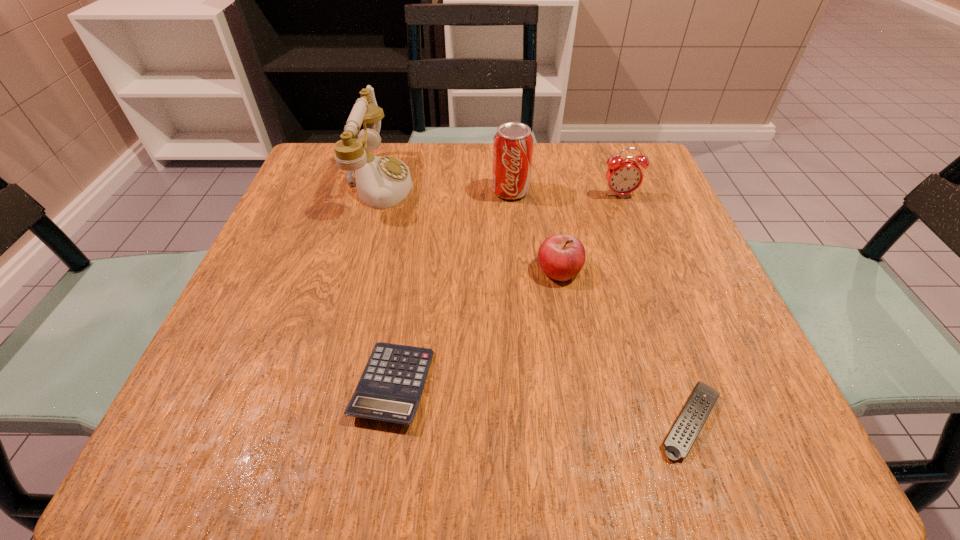
This screenshot has height=540, width=960. Identify the location of vacant space that's between the apple and the telephone. (469, 226).

Identify the location of unoccupied area between the tallest object and the remote control. The height and width of the screenshot is (540, 960). (535, 302).

Locate which object is the closest to the calculator. Please provide its 2D coordinates. Your answer should be formatted as a tuple, i.e. [(x, y)], where the tuple contains the x and y coordinates of a point satisfying the conditions above.

[(561, 257)]

Locate which object ranks in proximity to the alarm clock. Please provide its 2D coordinates. Your answer should be formatted as a tuple, i.e. [(x, y)], where the tuple contains the x and y coordinates of a point satisfying the conditions above.

[(513, 143)]

Find the location of a particular element. This screenshot has height=540, width=960. free region that satisfies the following two spatial constraints: 1. on the back side of the second tallest object; 2. on the dial of the tallest object is located at coordinates (510, 183).

Find the location of a particular element. The height and width of the screenshot is (540, 960). vacant area in the image that satisfies the following two spatial constraints: 1. on the dial of the tallest object; 2. on the left side of the remote control is located at coordinates (313, 421).

Image resolution: width=960 pixels, height=540 pixels. Find the location of `vacant space that satisfies the following two spatial constraints: 1. on the dial of the telephone; 2. on the right side of the shortest object`. vacant space that satisfies the following two spatial constraints: 1. on the dial of the telephone; 2. on the right side of the shortest object is located at coordinates (313, 421).

At what (x,y) coordinates should I click in order to perform the action: click on vacant space that satisfies the following two spatial constraints: 1. on the back side of the soda can; 2. on the dial of the telephone. Please return your answer as a coordinate pair (x, y). Looking at the image, I should click on (510, 183).

The height and width of the screenshot is (540, 960). I want to click on free space that satisfies the following two spatial constraints: 1. on the dial of the telephone; 2. on the back side of the soda can, so [x=376, y=191].

Locate an element on the screen. The width and height of the screenshot is (960, 540). free space that satisfies the following two spatial constraints: 1. on the dial of the telephone; 2. on the right side of the soda can is located at coordinates (376, 191).